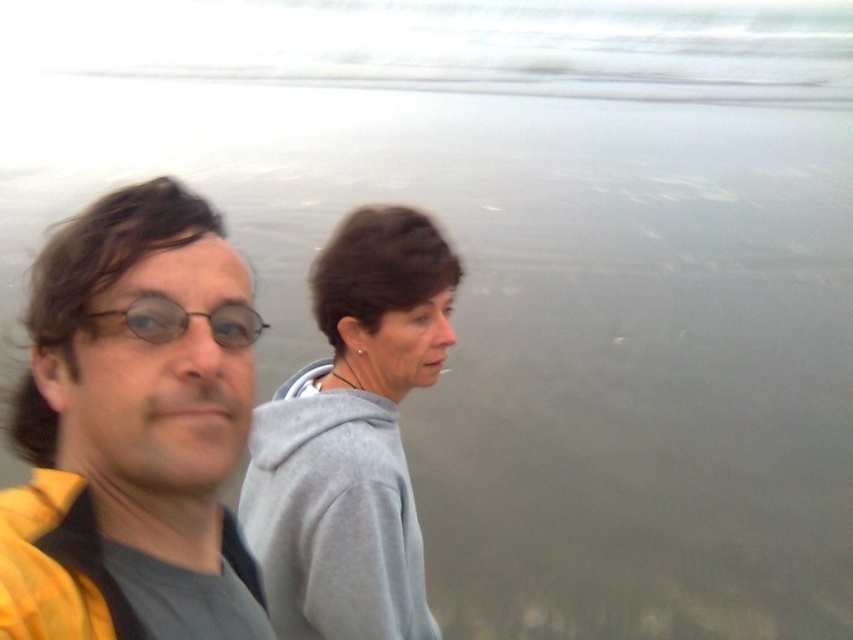
You are a photographer trying to capture a clear shot of the matte black glasses at left. However, the yellow fabric at left is blocking your view. Can you adjust your position to see the glasses without the fabric overlapping?

The yellow fabric at left is in front of the matte black glasses at left, so moving your camera position slightly behind or to the side of the current angle might allow you to see the glasses without the fabric blocking the view.

You are a photographer positioned at the shoreline. You want to capture a photo of the yellow fabric at left and the gray fleece at center. Which object will appear larger in the photo?

The yellow fabric at left will appear larger in the photo because it is closer to the viewer than the gray fleece at center.

You are standing at the shoreline and want to reach a seashell located at point (288, 410). If your maximum comfortable walking distance is 5 feet, can you comfortably reach the seashell without straining?

The distance of point (288, 410) from camera is 5.72 feet, so you cannot comfortably reach the seashell without straining as it is beyond your 5 feet limit.